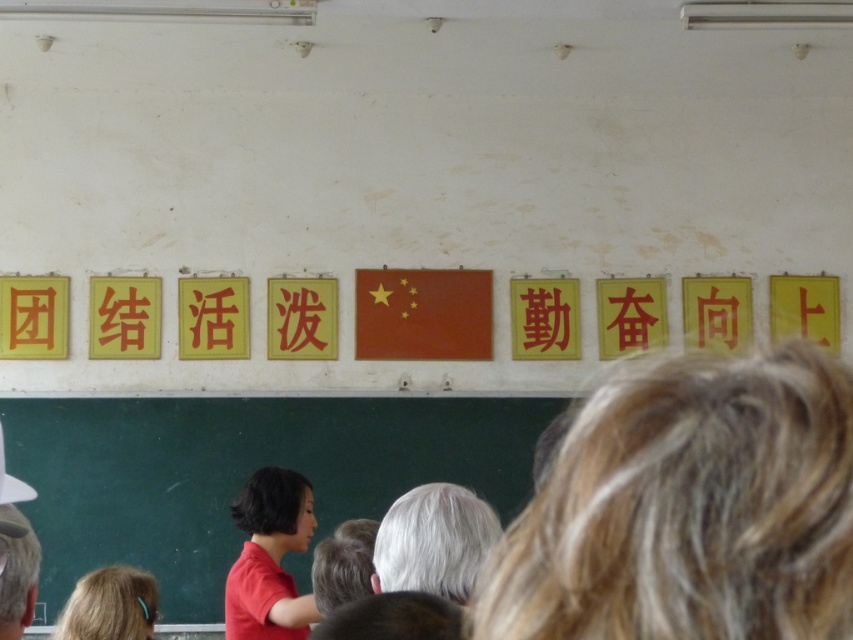
Which is in front, point (399, 502) or point (67, 637)?

Positioned in front is point (399, 502).

From the picture: Is gray hair at center in front of blonde hair at lower left?

Yes.

Is point (405, 564) positioned in front of point (88, 586)?

Yes, it is in front of point (88, 586).

You are a GUI agent. You are given a task and a screenshot of the screen. Output one action in this format:
    pyautogui.click(x=<x>, y=<y>)
    Task: Click on the gray hair at center
    The width and height of the screenshot is (853, 640).
    Given the screenshot: What is the action you would take?
    pyautogui.click(x=433, y=541)

Is red matte shirt at center in front of gray hair at center?

That is False.

Does point (276, 579) lie in front of point (419, 577)?

That is False.

Identify the location of red matte shirt at center. (270, 557).

Can you confirm if blonde hair at center is shorter than blonde hair at lower left?

No.

I want to click on blonde hair at center, so click(x=689, y=508).

Describe the element at coordinates (689, 508) in the screenshot. I see `blonde hair at center` at that location.

What are the coordinates of `blonde hair at center` in the screenshot? It's located at (689, 508).